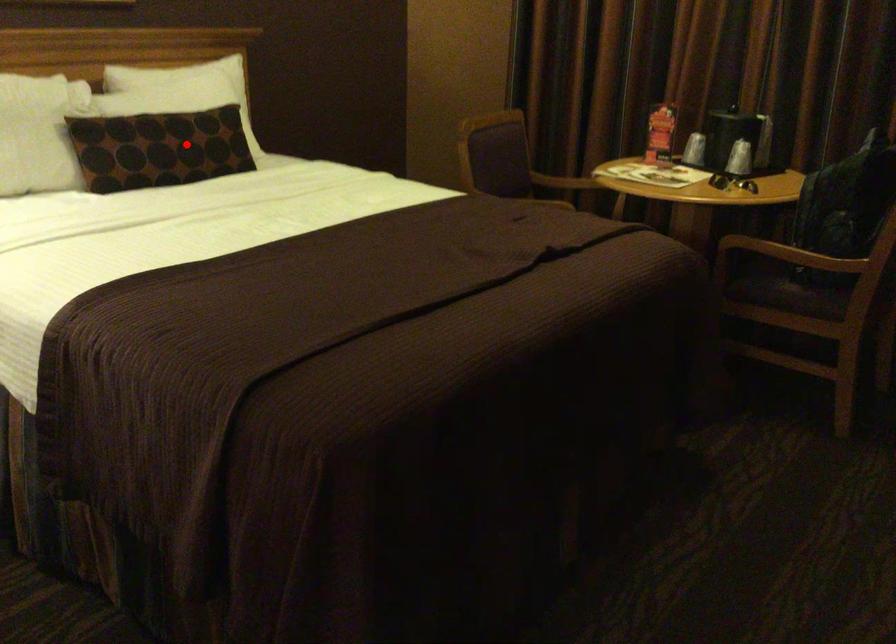
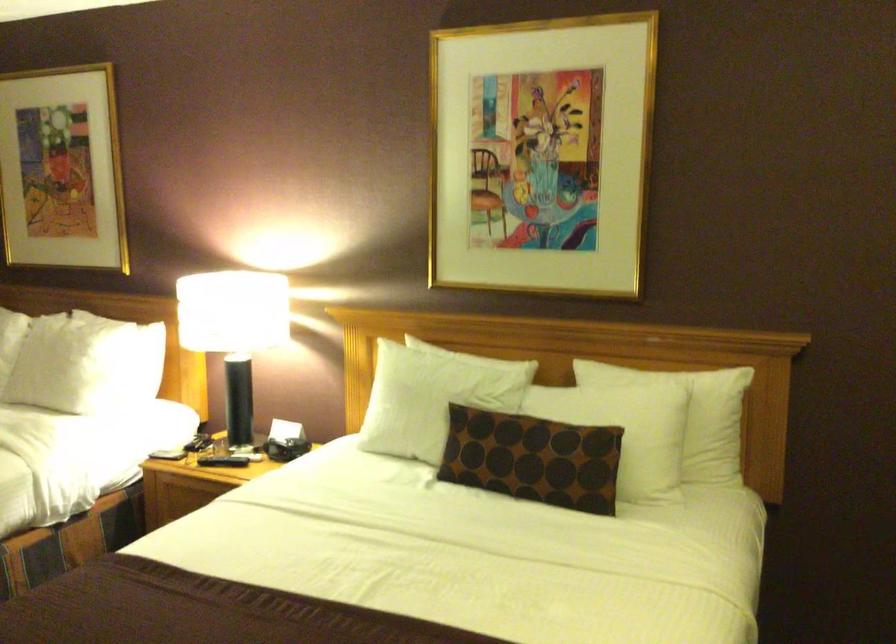
Locate, in the second image, the point that corresponds to the highlighted location in the first image.

(532, 458)